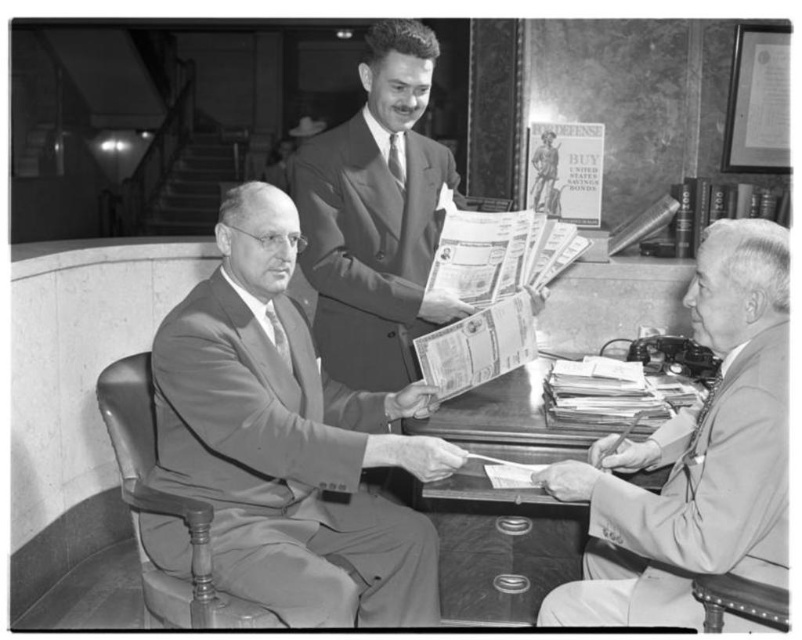
Can you confirm if smooth gray suit at center is shorter than smooth beige suit at right?

Incorrect, smooth gray suit at center's height does not fall short of smooth beige suit at right's.

Does point (383, 561) come closer to viewer compared to point (699, 604)?

No, it is not.

At what (x,y) coordinates should I click in order to perform the action: click on smooth gray suit at center. Please return your answer as a coordinate pair (x, y). The height and width of the screenshot is (640, 802). Looking at the image, I should click on (288, 442).

Based on the photo, who is taller, smooth beige suit at right or smooth suit at center?

Standing taller between the two is smooth suit at center.

Is smooth beige suit at right shorter than smooth suit at center?

Yes, smooth beige suit at right is shorter than smooth suit at center.

Is point (570, 483) in front of point (383, 76)?

Yes, point (570, 483) is in front of point (383, 76).

In order to click on smooth beige suit at right in this screenshot , I will do point(695,456).

Between smooth gray suit at center and smooth suit at center, which one appears on the right side from the viewer's perspective?

smooth suit at center

Can you confirm if smooth gray suit at center is positioned below smooth suit at center?

Yes, smooth gray suit at center is below smooth suit at center.

Between point (211, 422) and point (339, 372), which one is positioned in front?

Point (211, 422) is more forward.

At what (x,y) coordinates should I click in order to perform the action: click on smooth gray suit at center. Please return your answer as a coordinate pair (x, y). Looking at the image, I should click on (288, 442).